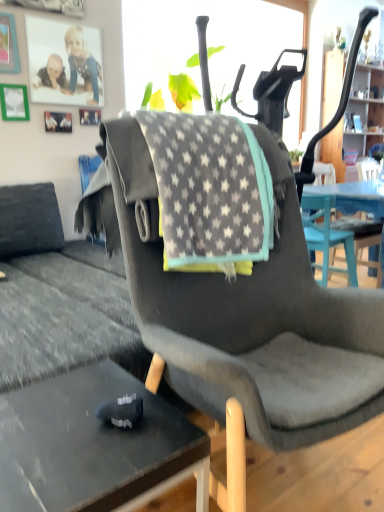
Question: From a real-world perspective, is black glass desk at lower left physically above dark gray fabric chair at center?

Choices:
 (A) yes
 (B) no

Answer: (B)

Question: Considering the relative sizes of black glass desk at lower left and dark gray fabric chair at center in the image provided, is black glass desk at lower left taller than dark gray fabric chair at center?

Choices:
 (A) no
 (B) yes

Answer: (A)

Question: From the image's perspective, is black glass desk at lower left above dark gray fabric chair at center?

Choices:
 (A) yes
 (B) no

Answer: (B)

Question: From the image's perspective, would you say black glass desk at lower left is shown under dark gray fabric chair at center?

Choices:
 (A) yes
 (B) no

Answer: (A)

Question: Can you confirm if black glass desk at lower left is thinner than dark gray fabric chair at center?

Choices:
 (A) yes
 (B) no

Answer: (A)

Question: Can you see black glass desk at lower left touching dark gray fabric chair at center?

Choices:
 (A) no
 (B) yes

Answer: (A)

Question: Can you confirm if wooden cabinet at upper right is taller than gray star-patterned fabric at center?

Choices:
 (A) yes
 (B) no

Answer: (A)

Question: From the image's perspective, is wooden cabinet at upper right on gray star-patterned fabric at center?

Choices:
 (A) no
 (B) yes

Answer: (B)

Question: Can you confirm if wooden cabinet at upper right is wider than gray star-patterned fabric at center?

Choices:
 (A) yes
 (B) no

Answer: (B)

Question: From the image's perspective, does wooden cabinet at upper right appear lower than gray star-patterned fabric at center?

Choices:
 (A) no
 (B) yes

Answer: (A)

Question: Can you confirm if wooden cabinet at upper right is thinner than gray star-patterned fabric at center?

Choices:
 (A) yes
 (B) no

Answer: (A)

Question: Is wooden cabinet at upper right in contact with gray star-patterned fabric at center?

Choices:
 (A) yes
 (B) no

Answer: (B)

Question: Is gray star-patterned fabric at center surrounding black glass desk at lower left?

Choices:
 (A) no
 (B) yes

Answer: (A)